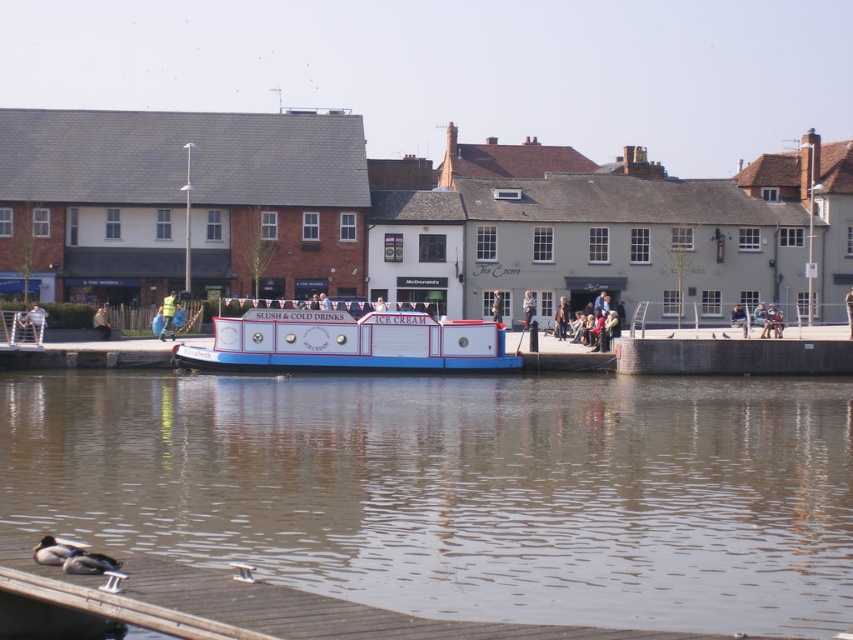
You are standing at a point and want to reach the colorful ice cream boat docked along the water. The boat is at point marked as point (294,324). If you can walk 250 feet in 10 minutes, how long will it take you to reach the boat?

The distance between you and the boat at point (294,324) is 208.91 feet. Since you can walk 250 feet in 10 minutes, it will take approximately 8.36 minutes to reach the boat.

You are planning to place a dark brown leather jacket at center on the white wooden boat at center. Based on their widths, will the jacket fit entirely on the boat?

The white wooden boat at center is wider than the dark brown leather jacket at center, so the jacket will fit entirely on the boat.

You are organizing a charity event and need to display two jackets on a small table. The light blue fabric jacket at left and the dark brown leather jacket at center are available. Based on their sizes, which jacket would be more suitable to place on the table without taking up too much space?

The light blue fabric jacket at left occupies less space than the dark brown leather jacket at center, so it would be more suitable for the small table.